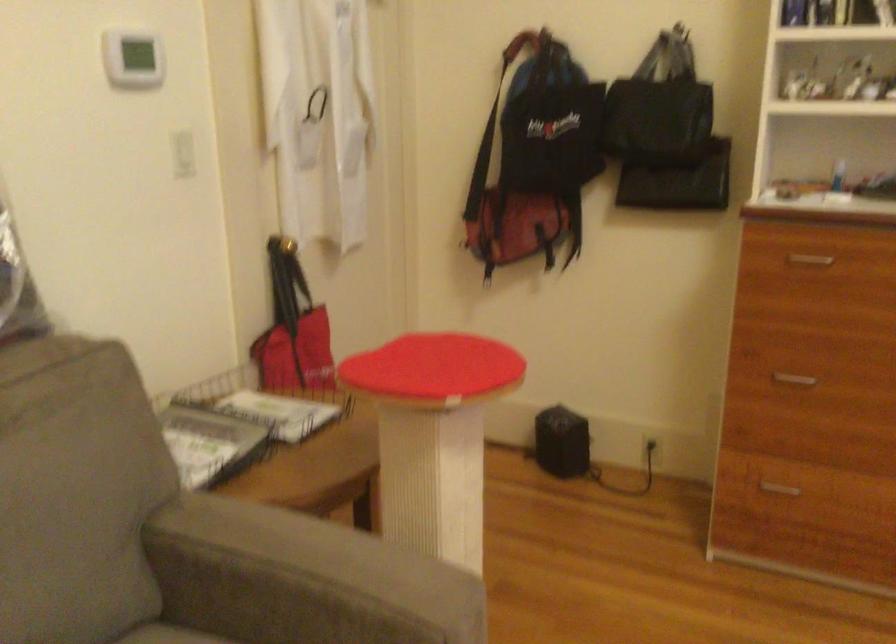
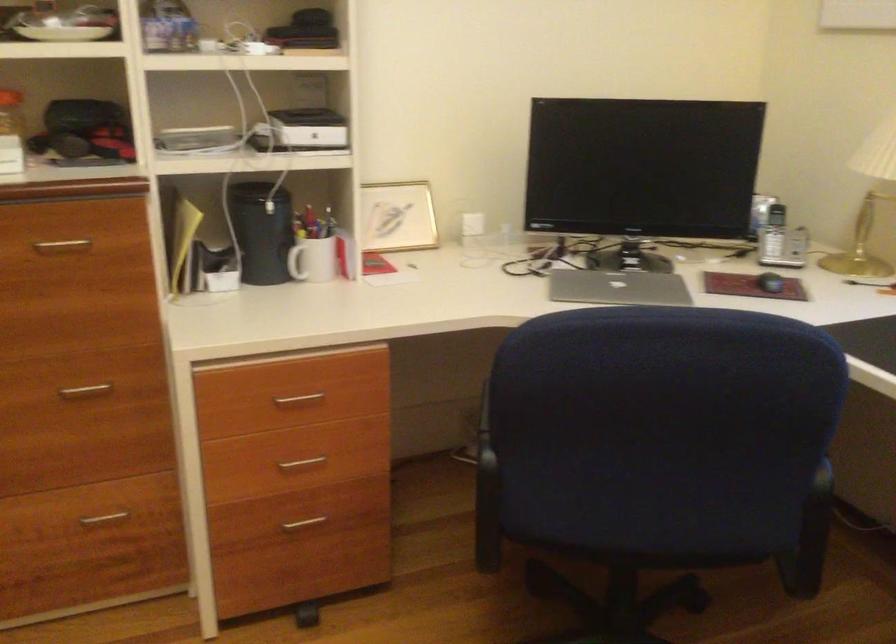
Question: How did the camera likely rotate?

Choices:
 (A) Left
 (B) Right
 (C) Up
 (D) Down

Answer: (B)